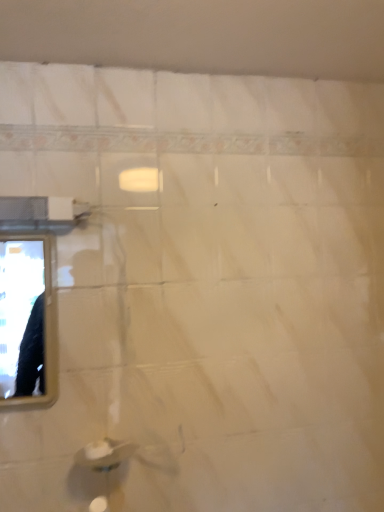
The width and height of the screenshot is (384, 512). What do you see at coordinates (28, 320) in the screenshot?
I see `metallic rectangular mirror at left` at bounding box center [28, 320].

Find the location of a particular element. The height and width of the screenshot is (512, 384). metallic rectangular mirror at left is located at coordinates (28, 320).

Identify the location of metallic rectangular mirror at left. (28, 320).